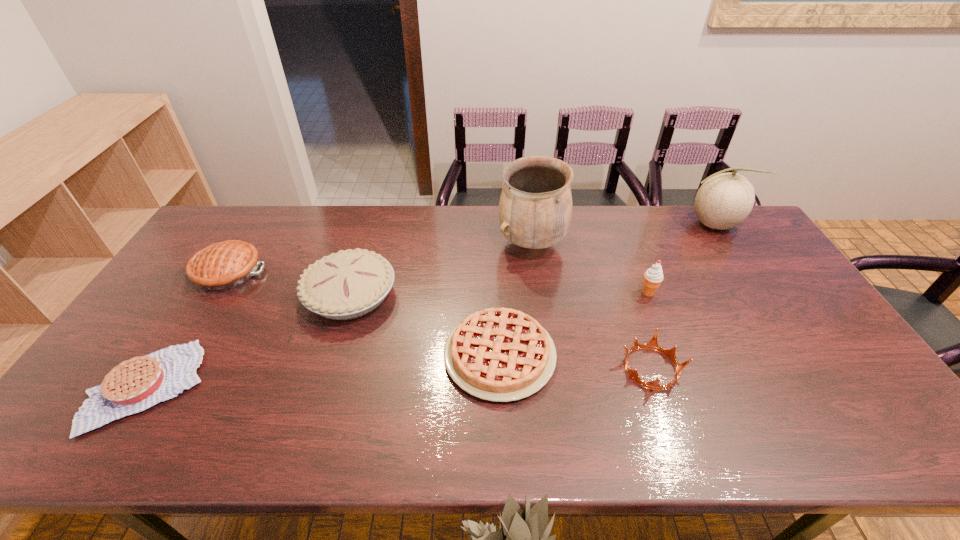
Image resolution: width=960 pixels, height=540 pixels. In order to click on vacant space located on the front of the cantaloup in this screenshot , I will do `click(749, 282)`.

Find the location of a particular element. vacant space located 0.240m on the front of the icecream is located at coordinates (677, 366).

The width and height of the screenshot is (960, 540). Identify the location of vacant area situated 0.100m on the front of the second pie from right to left. (331, 360).

Find the location of `free space located on the right of the fifth tallest object`. free space located on the right of the fifth tallest object is located at coordinates (354, 272).

The width and height of the screenshot is (960, 540). What are the coordinates of `vacant space located on the right of the crown` in the screenshot? It's located at (733, 368).

You are a GUI agent. You are given a task and a screenshot of the screen. Output one action in this format:
    pyautogui.click(x=<x>, y=<y>)
    Task: Click on the free location located 0.110m on the right of the second shortest object
    
    Given the screenshot: What is the action you would take?
    pyautogui.click(x=597, y=355)

Locate an element on the screen. This screenshot has width=960, height=540. blank space located on the right of the shortest pie is located at coordinates (359, 387).

In order to click on urn situated at the far edge in this screenshot , I will do `click(535, 208)`.

The height and width of the screenshot is (540, 960). Find the location of `cantaloup located in the far edge section of the desktop`. cantaloup located in the far edge section of the desktop is located at coordinates (724, 200).

Locate an element on the screen. object that is at the near edge is located at coordinates (137, 384).